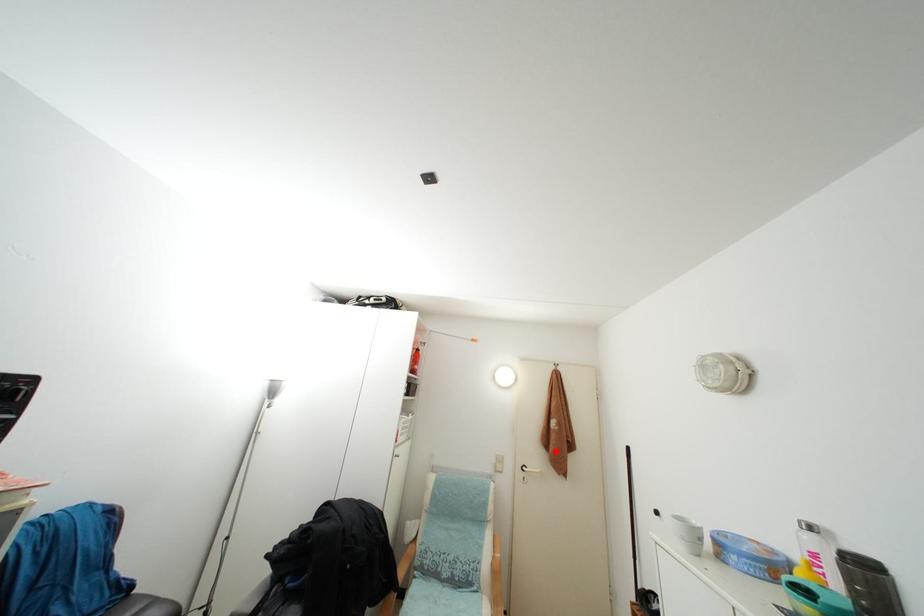
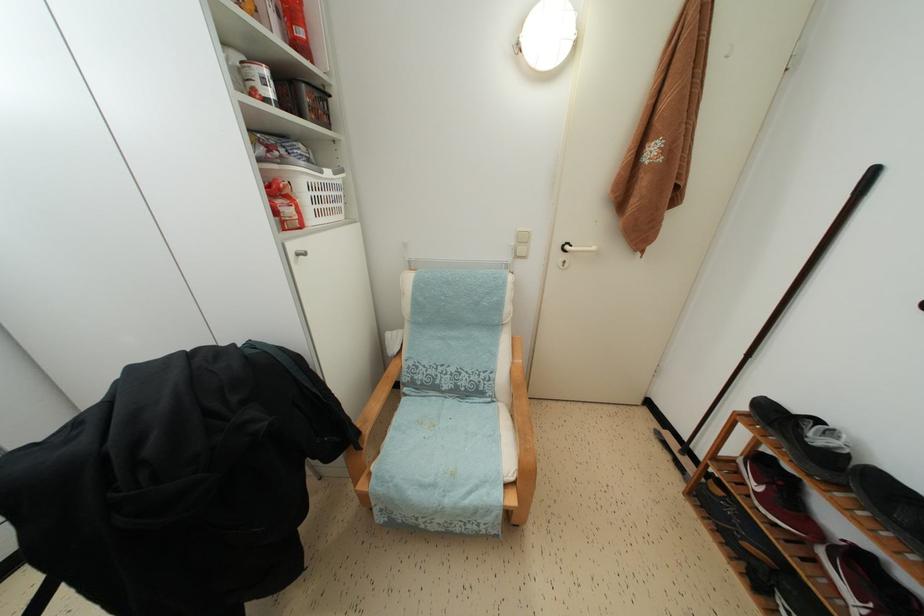
Question: I am providing you with two images of the same scene from different viewpoints. Image1 has a red point marked. In image2, the corresponding 3D location appears at what relative position? Reply with the corresponding letter.

Choices:
 (A) Closer
 (B) Farther

Answer: (A)